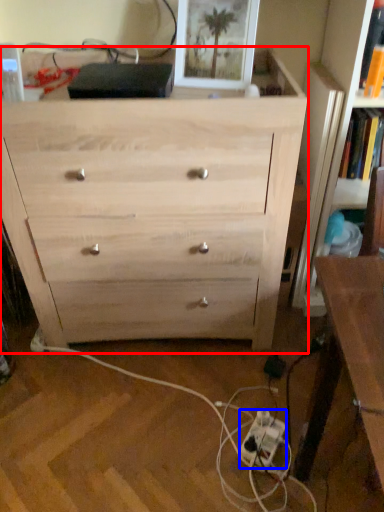
Question: Which object appears farthest to the camera in this image, chest of drawers (highlighted by a red box) or extension cord (highlighted by a blue box)?

Choices:
 (A) chest of drawers
 (B) extension cord

Answer: (B)